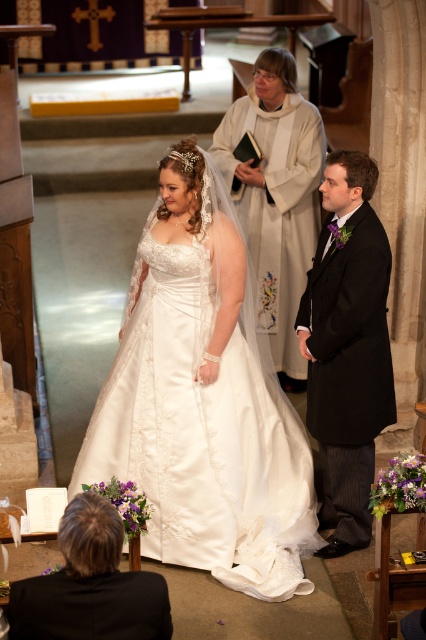
Between satin dress at center and black suit at lower left, which one is positioned lower?

black suit at lower left is lower down.

At what (x,y) coordinates should I click in order to perform the action: click on satin dress at center. Please return your answer as a coordinate pair (x, y). The height and width of the screenshot is (640, 426). Looking at the image, I should click on (276, 196).

Image resolution: width=426 pixels, height=640 pixels. In order to click on satin dress at center in this screenshot , I will do `click(276, 196)`.

Who is lower down, matte black suit at right or black suit at lower left?

black suit at lower left is lower down.

Is matte black suit at right further to the viewer compared to black suit at lower left?

Yes, matte black suit at right is behind black suit at lower left.

Does point (363, 433) lie behind point (62, 586)?

Yes, it is behind point (62, 586).

What are the coordinates of `matte black suit at right` in the screenshot? It's located at (348, 348).

From the picture: Is satin/embroidered dress at center positioned at the back of black suit at lower left?

Yes, it is behind black suit at lower left.

The image size is (426, 640). In order to click on satin/embroidered dress at center in this screenshot , I will do [204, 435].